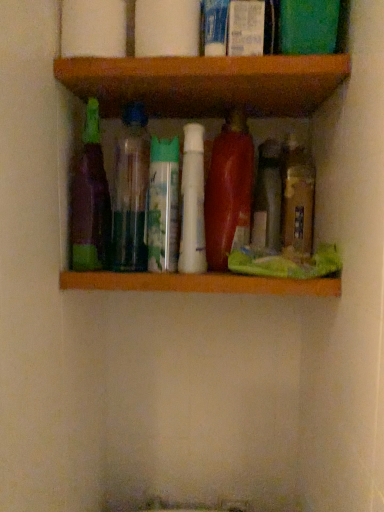
Question: Can you confirm if white matte toilet paper at upper center, which is the 2th toilet paper in right-to-left order, is taller than white plastic tube at upper center, which is the second toiletry in right-to-left order?

Choices:
 (A) no
 (B) yes

Answer: (A)

Question: Can you confirm if white matte toilet paper at upper center, which is the 2th toilet paper in right-to-left order, is positioned to the left of white plastic tube at upper center, which appears as the 1th toiletry when viewed from the left?

Choices:
 (A) yes
 (B) no

Answer: (A)

Question: From a real-world perspective, is white matte toilet paper at upper center, which is the 2th toilet paper in right-to-left order, physically below white plastic tube at upper center, which appears as the 1th toiletry when viewed from the left?

Choices:
 (A) yes
 (B) no

Answer: (A)

Question: Is white matte toilet paper at upper center, which is the 2th toilet paper in right-to-left order, facing away from white plastic tube at upper center, which is the second toiletry in right-to-left order?

Choices:
 (A) yes
 (B) no

Answer: (B)

Question: From a real-world perspective, is white matte toilet paper at upper center, which is the 2th toilet paper in right-to-left order, on white plastic tube at upper center, which appears as the 1th toiletry when viewed from the left?

Choices:
 (A) no
 (B) yes

Answer: (A)

Question: Can you confirm if white matte toilet paper at upper center, which is the 2th toilet paper in right-to-left order, is shorter than white plastic tube at upper center, which is the second toiletry in right-to-left order?

Choices:
 (A) no
 (B) yes

Answer: (B)

Question: Is the depth of translucent plastic bottle at center, marked as the 1th bottle in a right-to-left arrangement, greater than that of translucent plastic bottles at center, the 2th bottle when ordered from left to right?

Choices:
 (A) yes
 (B) no

Answer: (A)

Question: Is translucent plastic bottle at center, marked as the 1th bottle in a right-to-left arrangement, closer to the viewer compared to translucent plastic bottles at center, the 5th bottle positioned from the right?

Choices:
 (A) yes
 (B) no

Answer: (B)

Question: Can you confirm if translucent plastic bottle at center, which appears as the 6th bottle when viewed from the left, is wider than translucent plastic bottles at center, the 2th bottle when ordered from left to right?

Choices:
 (A) no
 (B) yes

Answer: (A)

Question: Considering the relative sizes of translucent plastic bottle at center, marked as the 1th bottle in a right-to-left arrangement, and translucent plastic bottles at center, the 5th bottle positioned from the right, in the image provided, is translucent plastic bottle at center, marked as the 1th bottle in a right-to-left arrangement, smaller than translucent plastic bottles at center, the 5th bottle positioned from the right,?

Choices:
 (A) yes
 (B) no

Answer: (A)

Question: From a real-world perspective, is translucent plastic bottle at center, which appears as the 6th bottle when viewed from the left, on translucent plastic bottles at center, the 5th bottle positioned from the right?

Choices:
 (A) no
 (B) yes

Answer: (A)

Question: Is translucent plastic bottle at center, which appears as the 6th bottle when viewed from the left, thinner than translucent plastic bottles at center, the 2th bottle when ordered from left to right?

Choices:
 (A) yes
 (B) no

Answer: (A)

Question: Considering the relative positions of shiny red plastic bottle at center, the third bottle from the right, and white glossy lotion at upper center, which appears as the second toiletry when viewed from the left, in the image provided, is shiny red plastic bottle at center, the third bottle from the right, to the right of white glossy lotion at upper center, which appears as the second toiletry when viewed from the left, from the viewer's perspective?

Choices:
 (A) no
 (B) yes

Answer: (A)